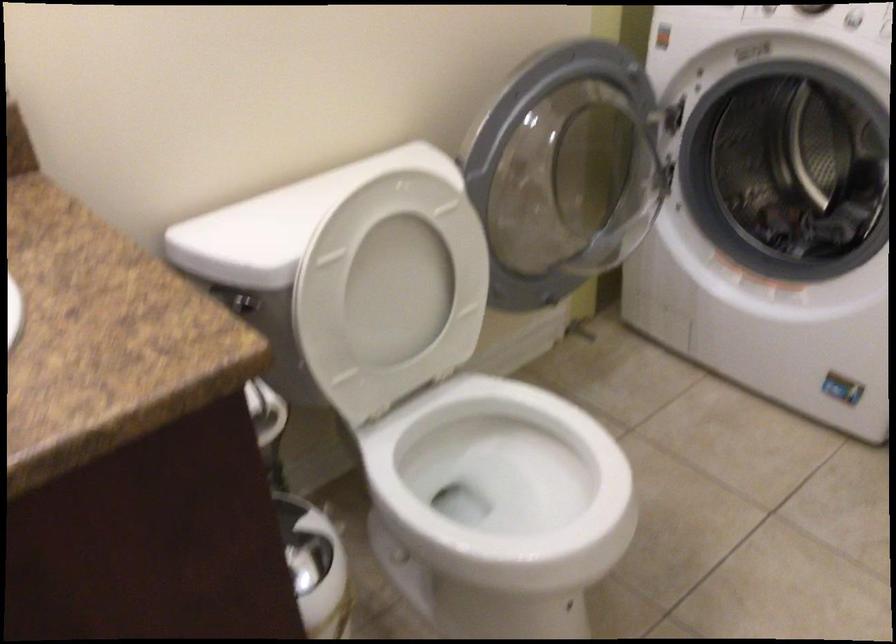
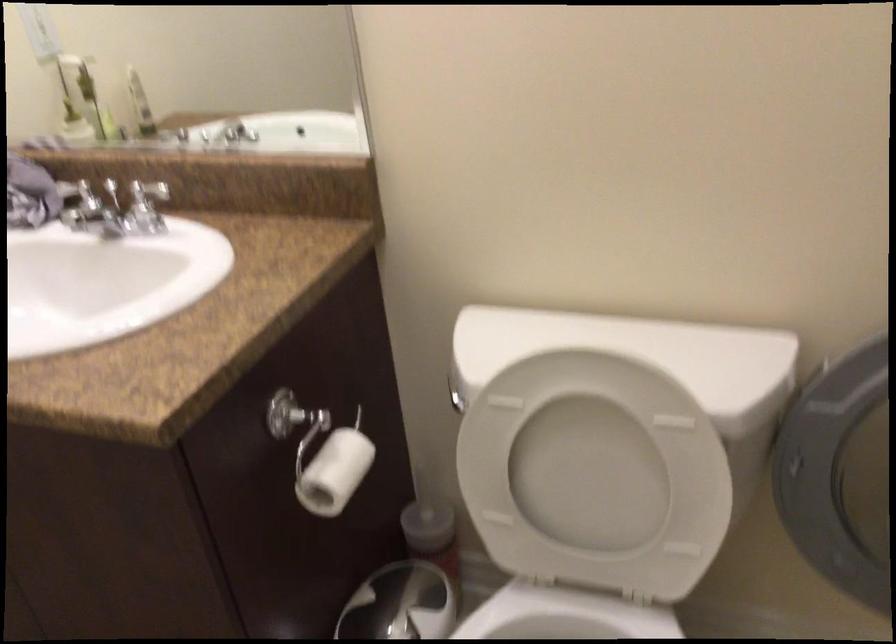
Locate, in the second image, the point that corresponds to pixel 418 427 in the first image.

(564, 616)